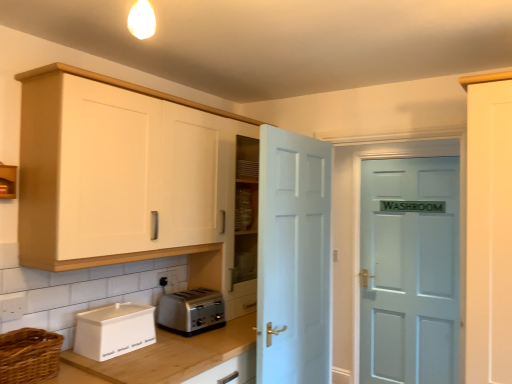
Question: Considering the positions of matte wood cabinet at upper left, placed as the 1th cabinetry when sorted from left to right, and satin silver toaster at lower center in the image, is matte wood cabinet at upper left, placed as the 1th cabinetry when sorted from left to right, bigger or smaller than satin silver toaster at lower center?

Choices:
 (A) small
 (B) big

Answer: (A)

Question: From their relative heights in the image, would you say matte wood cabinet at upper left, which is counted as the 2th cabinetry, starting from the right, is taller or shorter than satin silver toaster at lower center?

Choices:
 (A) tall
 (B) short

Answer: (B)

Question: Which is nearer to the satin silver toaster at lower center?

Choices:
 (A) white plastic electric outlet at lower center
 (B) wooden at lower left
 (C) white matte bread bin at lower left
 (D) white matte cabinet at upper left, which is the second cabinetry in left-to-right order
 (E) woven brown basket at lower left

Answer: (B)

Question: Which object is the closest to the white painted wood door at center, marked as the 1th door in a front-to-back arrangement?

Choices:
 (A) satin silver toaster at lower center
 (B) woven brown basket at lower left
 (C) white plastic electric outlet at lower center
 (D) white matte bread bin at lower left
 (E) white wooden door at right, the 2th door when ordered from front to back

Answer: (A)